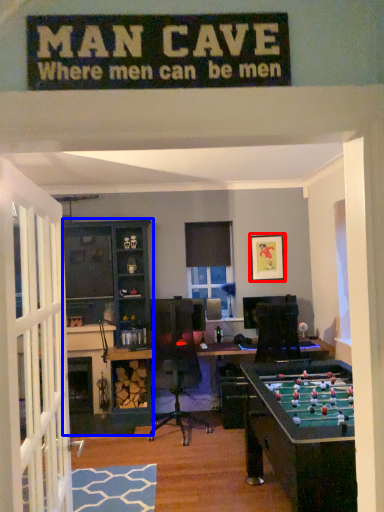
Question: Which object appears farthest to the camera in this image, picture frame (highlighted by a red box) or entertainment center (highlighted by a blue box)?

Choices:
 (A) picture frame
 (B) entertainment center

Answer: (A)